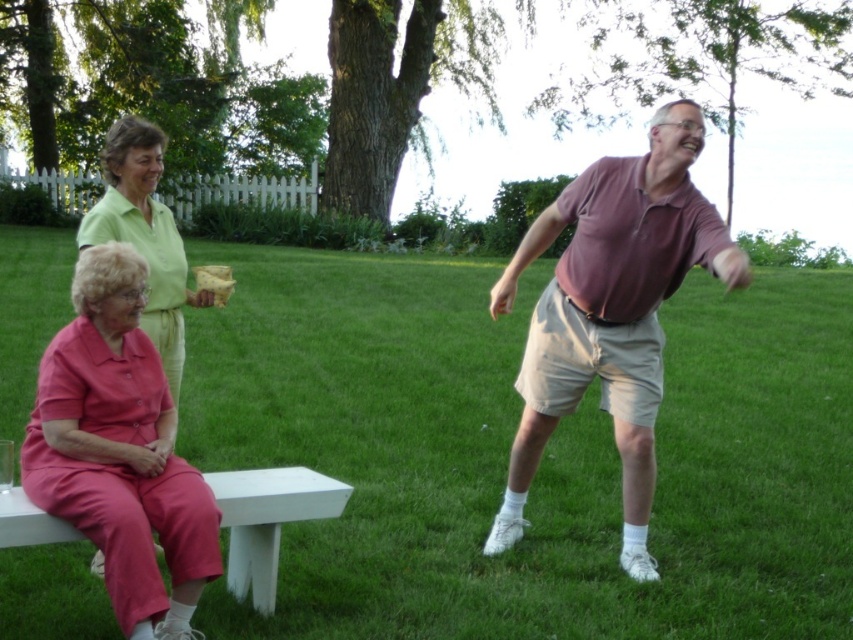
Question: Based on their relative distances, which object is farther from the pink fabric pants at lower left?

Choices:
 (A) matte purple shirt at center
 (B) white matte bench at lower left

Answer: (A)

Question: Which object is the farthest from the pink fabric pants at lower left?

Choices:
 (A) white matte bench at lower left
 (B) matte purple shirt at center

Answer: (B)

Question: Is matte purple shirt at center positioned in front of pink fabric pants at lower left?

Choices:
 (A) yes
 (B) no

Answer: (B)

Question: Which point is farther to the camera?

Choices:
 (A) (138, 442)
 (B) (601, 353)

Answer: (B)

Question: Is matte purple shirt at center further to camera compared to white matte bench at lower left?

Choices:
 (A) no
 (B) yes

Answer: (B)

Question: Can you confirm if pink fabric pants at lower left is smaller than white matte bench at lower left?

Choices:
 (A) no
 (B) yes

Answer: (A)